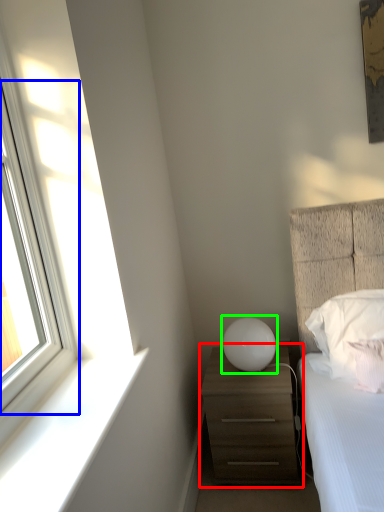
Question: Considering the real-world distances, which object is closest to chest of drawers (highlighted by a red box)? window (highlighted by a blue box) or table lamp (highlighted by a green box).

Choices:
 (A) window
 (B) table lamp

Answer: (B)